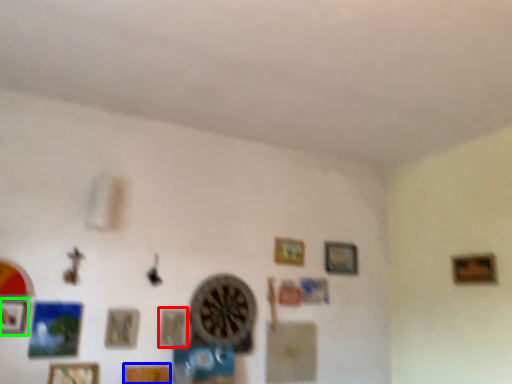
Question: Considering the real-world distances, which object is farthest from picture frame (highlighted by a red box)? picture frame (highlighted by a blue box) or picture frame (highlighted by a green box)?

Choices:
 (A) picture frame
 (B) picture frame

Answer: (B)